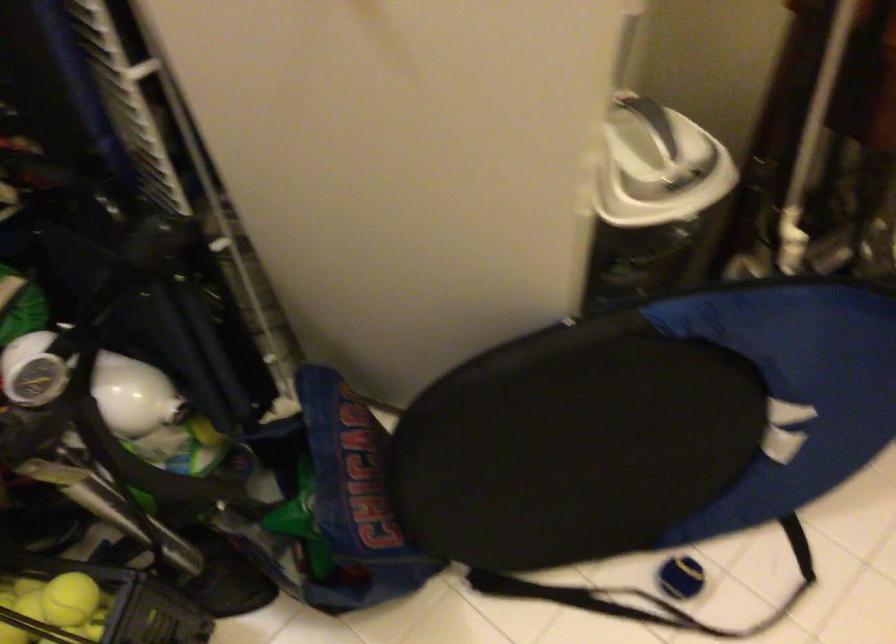
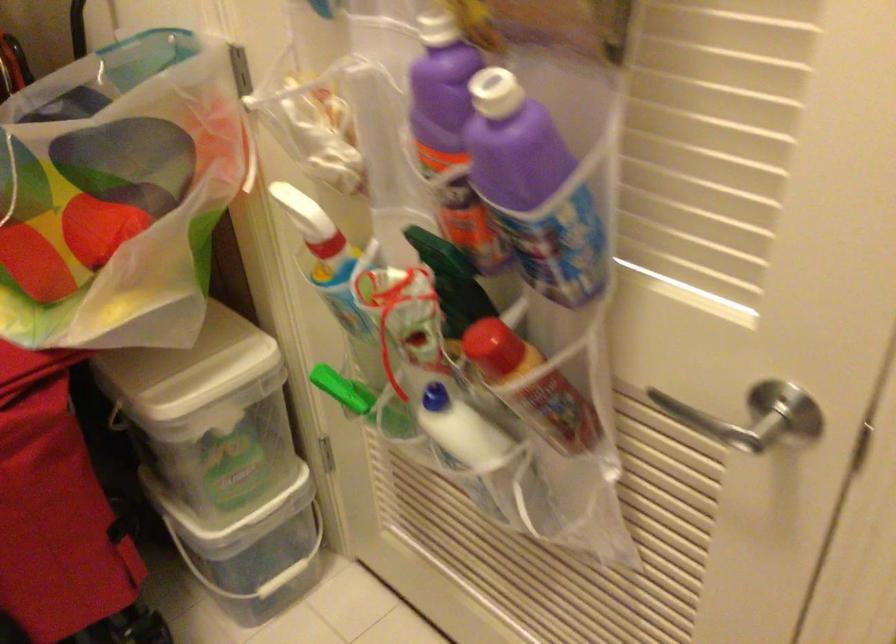
Question: The camera is either moving clockwise (left) or counter-clockwise (right) around the object. The first image is from the beginning of the video and the second image is from the end. Is the camera moving left or right when shooting the video?

Choices:
 (A) Left
 (B) Right

Answer: (A)